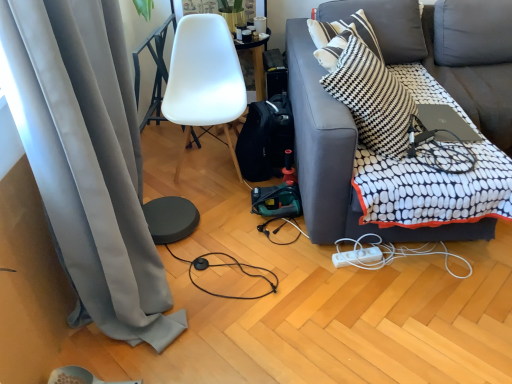
Question: Does gray fabric curtain at left have a larger size compared to black cable at lower center?

Choices:
 (A) no
 (B) yes

Answer: (B)

Question: Is gray fabric curtain at left positioned far away from black cable at lower center?

Choices:
 (A) yes
 (B) no

Answer: (B)

Question: Does gray fabric curtain at left appear on the right side of black cable at lower center?

Choices:
 (A) no
 (B) yes

Answer: (A)

Question: Can you confirm if gray fabric curtain at left is thinner than black cable at lower center?

Choices:
 (A) yes
 (B) no

Answer: (A)

Question: Is the surface of gray fabric curtain at left in direct contact with black cable at lower center?

Choices:
 (A) yes
 (B) no

Answer: (B)

Question: Is gray fabric curtain at left closer to the viewer compared to black cable at lower center?

Choices:
 (A) no
 (B) yes

Answer: (B)

Question: Can you confirm if white plastic power outlet at lower center is bigger than white matte chair at center?

Choices:
 (A) yes
 (B) no

Answer: (B)

Question: Can you confirm if white plastic power outlet at lower center is positioned to the left of white matte chair at center?

Choices:
 (A) no
 (B) yes

Answer: (A)

Question: Is white plastic power outlet at lower center facing towards white matte chair at center?

Choices:
 (A) yes
 (B) no

Answer: (B)

Question: Does white plastic power outlet at lower center have a greater height compared to white matte chair at center?

Choices:
 (A) no
 (B) yes

Answer: (A)

Question: Would you say white plastic power outlet at lower center is a long distance from white matte chair at center?

Choices:
 (A) no
 (B) yes

Answer: (B)

Question: Considering the relative sizes of white plastic power outlet at lower center and white matte chair at center in the image provided, is white plastic power outlet at lower center smaller than white matte chair at center?

Choices:
 (A) no
 (B) yes

Answer: (B)

Question: Does black fabric backpack at center have a greater width compared to white matte chair at center?

Choices:
 (A) yes
 (B) no

Answer: (A)